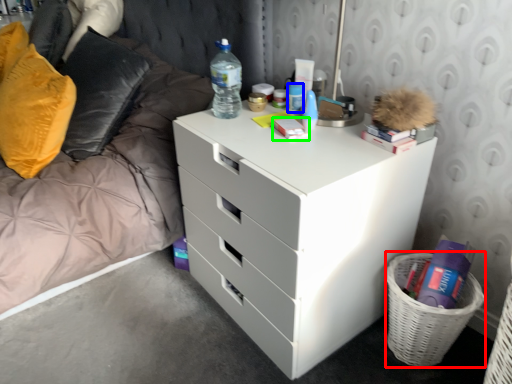
Question: Which object is the farthest from basket (highlighted by a red box)? Choose among these: toiletry (highlighted by a blue box) or book (highlighted by a green box).

Choices:
 (A) toiletry
 (B) book

Answer: (A)